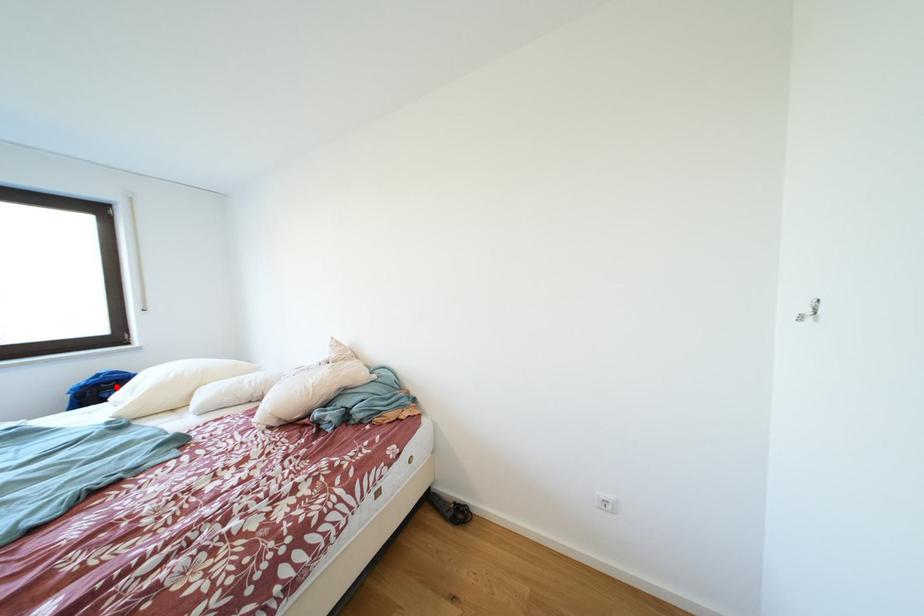
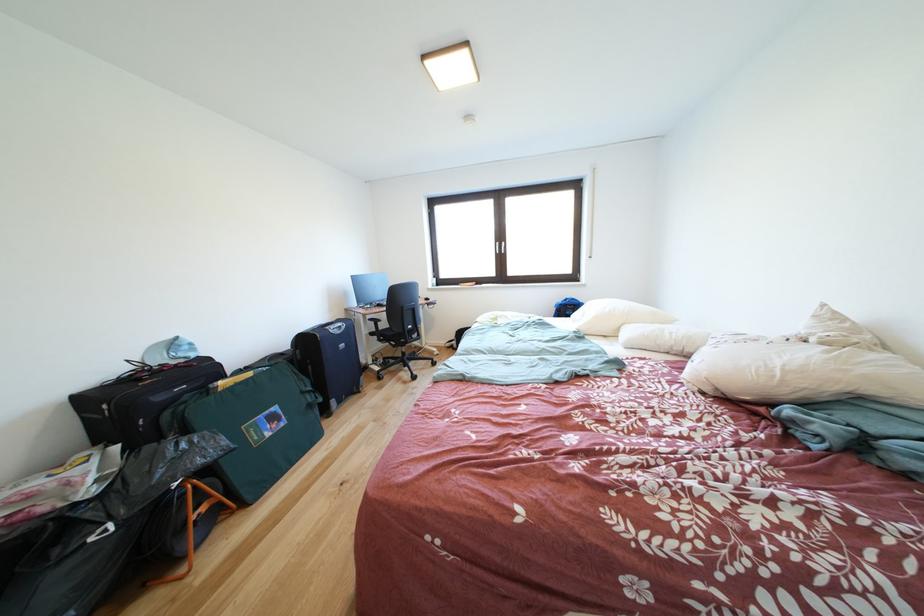
Find the pixel in the second image that matches the highlighted location in the first image.

(578, 310)